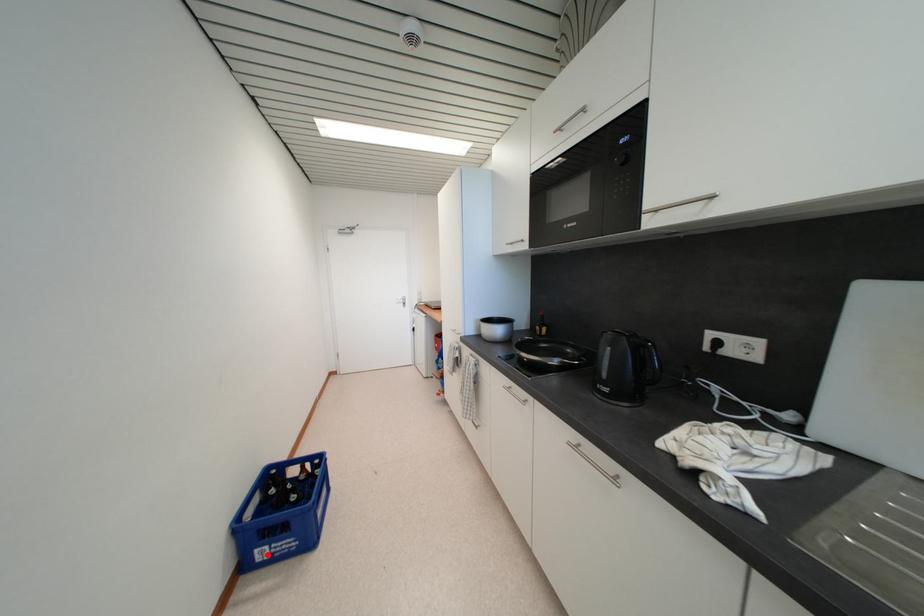
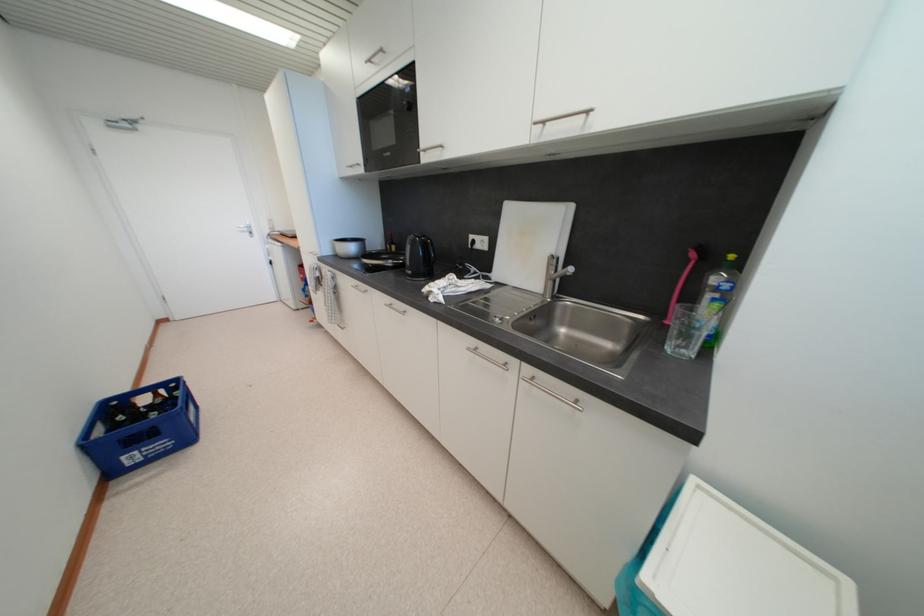
Where in the second image is the point corresponding to the highlighted location from the first image?

(138, 460)